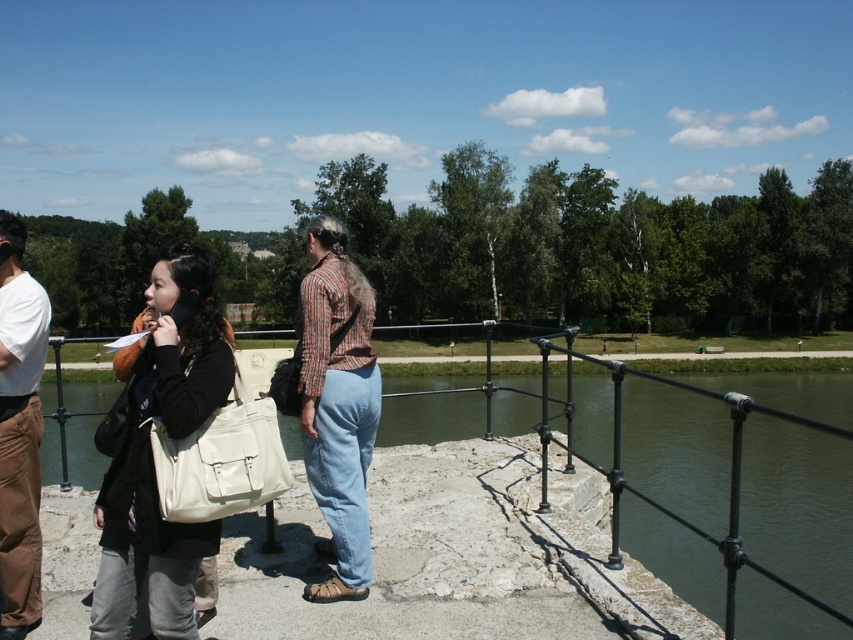
Looking at this image, you are a photographer positioned at the center of the stone platform. You want to capture a photo that includes both the matte black jacket at left and the denim pants at center. Which direction should you move to ensure both are in frame?

You should move to the right so that both the matte black jacket at left and the denim pants at center are within your camera frame.

You are a photographer trying to capture a candid shot of the people on the stone platform. You notice the matte black jacket at left and the brown suede pants at left. Which one is positioned more to the right side of the scene?

The matte black jacket at left is positioned more to the right side of the scene compared to the brown suede pants at left.

You are standing on the stone platform overlooking the water. There are two points marked on the platform. The first point is at coordinates point (322, 308) and the second point is at point (15, 481). If you are facing the water, which point is closer to the edge of the platform?

Point (15, 481) is closer to the edge of the platform because it is in front of point (322, 308) when facing the water.